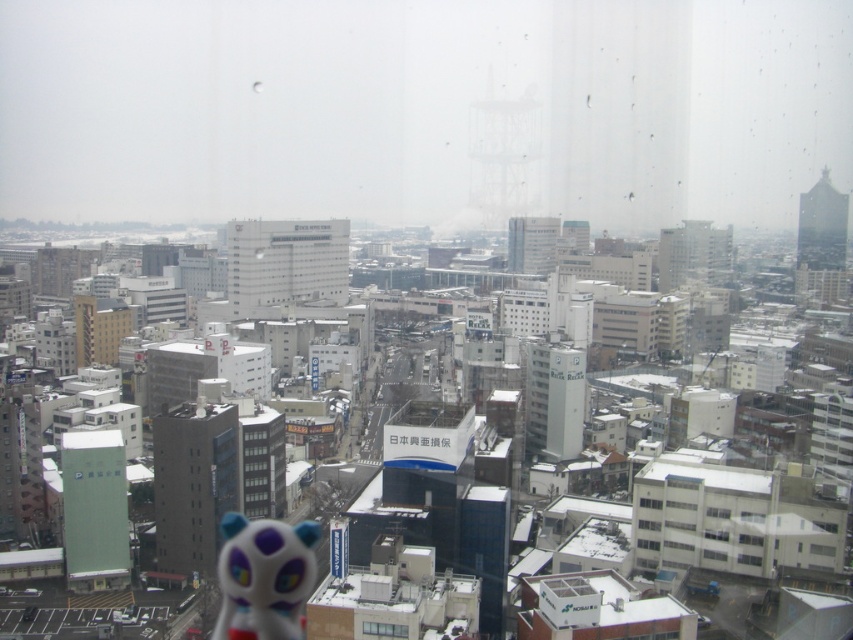
Question: Is white glossy toy at lower center closer to the viewer compared to transparent glass window at center?

Choices:
 (A) yes
 (B) no

Answer: (B)

Question: Can you confirm if white glossy toy at lower center is positioned above transparent glass window at center?

Choices:
 (A) no
 (B) yes

Answer: (A)

Question: Which object appears farthest from the camera in this image?

Choices:
 (A) transparent glass window at center
 (B) white glossy toy at lower center

Answer: (B)

Question: Can you confirm if white glossy toy at lower center is positioned to the right of transparent glass window at center?

Choices:
 (A) no
 (B) yes

Answer: (A)